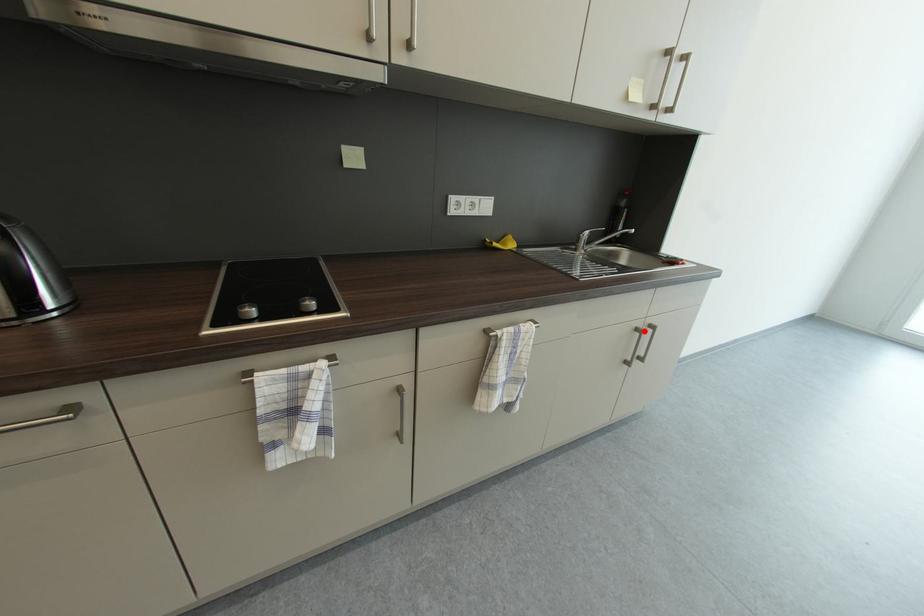
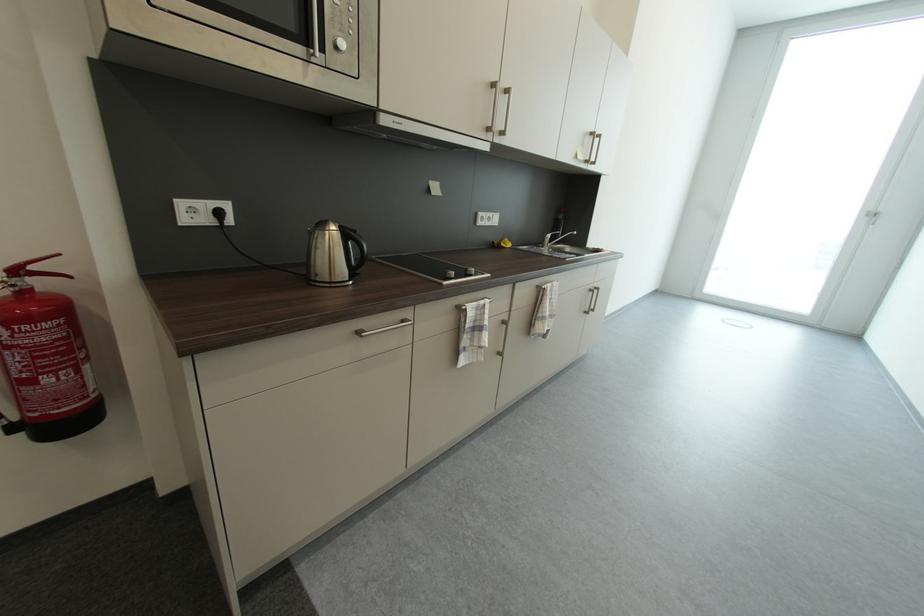
In the second image, find the point that corresponds to the highlighted location in the first image.

(598, 292)